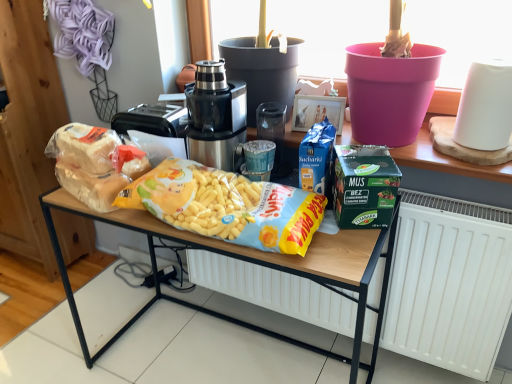
Question: From the image's perspective, is satin black juicer at center under yellow matte corn at center, which appears as the 2th cereal when viewed from the left?

Choices:
 (A) no
 (B) yes

Answer: (A)

Question: Would you consider satin black juicer at center to be distant from yellow matte corn at center, which appears as the 2th cereal when viewed from the left?

Choices:
 (A) yes
 (B) no

Answer: (B)

Question: Is satin black juicer at center surrounding yellow matte corn at center, which ranks as the first cereal in right-to-left order?

Choices:
 (A) yes
 (B) no

Answer: (B)

Question: From a real-world perspective, is satin black juicer at center below yellow matte corn at center, which ranks as the first cereal in right-to-left order?

Choices:
 (A) no
 (B) yes

Answer: (A)

Question: From a real-world perspective, is satin black juicer at center on top of yellow matte corn at center, which appears as the 2th cereal when viewed from the left?

Choices:
 (A) no
 (B) yes

Answer: (B)

Question: Does satin black juicer at center appear on the right side of yellow matte corn at center, which ranks as the first cereal in right-to-left order?

Choices:
 (A) no
 (B) yes

Answer: (A)

Question: Does yellow matte corn sticks at center have a greater width compared to satin black juicer at center?

Choices:
 (A) yes
 (B) no

Answer: (A)

Question: Is yellow matte corn sticks at center in contact with satin black juicer at center?

Choices:
 (A) yes
 (B) no

Answer: (B)

Question: Is yellow matte corn sticks at center further to the viewer compared to satin black juicer at center?

Choices:
 (A) yes
 (B) no

Answer: (B)

Question: From a real-world perspective, does yellow matte corn sticks at center stand above satin black juicer at center?

Choices:
 (A) no
 (B) yes

Answer: (A)

Question: Can you confirm if yellow matte corn sticks at center is shorter than satin black juicer at center?

Choices:
 (A) yes
 (B) no

Answer: (B)

Question: Is satin black juicer at center inside yellow matte corn sticks at center?

Choices:
 (A) no
 (B) yes

Answer: (A)

Question: Is yellow matte corn at center, which appears as the 2th cereal when viewed from the left, far away from green matte lunch box at center?

Choices:
 (A) no
 (B) yes

Answer: (A)